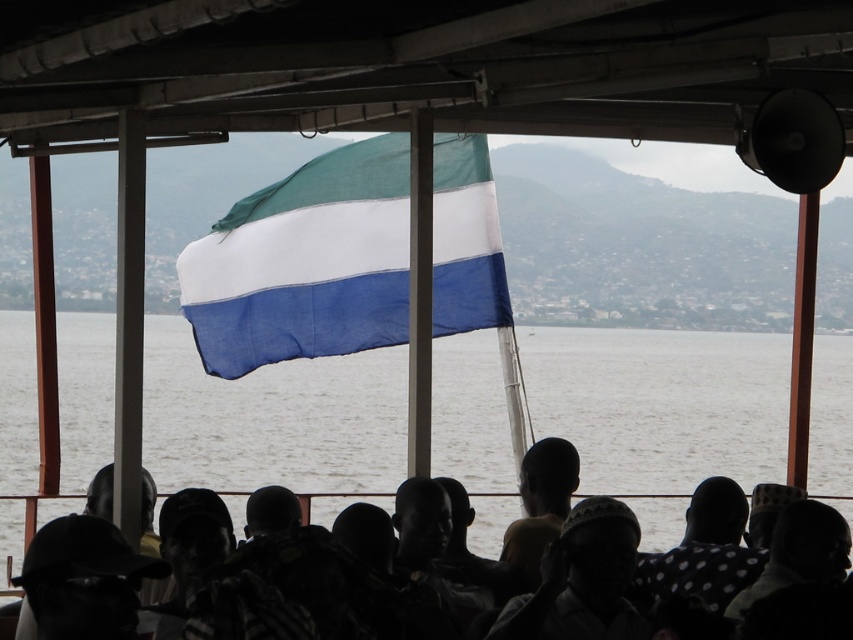
Can you confirm if blue fabric water at center is taller than textured fabric flag at center?

Yes, blue fabric water at center is taller than textured fabric flag at center.

Between point (7, 433) and point (231, 358), which one is positioned in front?

Positioned in front is point (231, 358).

What do you see at coordinates (660, 404) in the screenshot? The width and height of the screenshot is (853, 640). I see `blue fabric water at center` at bounding box center [660, 404].

At what (x,y) coordinates should I click in order to perform the action: click on blue fabric water at center. Please return your answer as a coordinate pair (x, y). Looking at the image, I should click on (660, 404).

Is point (625, 394) closer to viewer compared to point (569, 460)?

No, it is behind (569, 460).

Identify the location of blue fabric water at center. (660, 404).

The image size is (853, 640). What do you see at coordinates (660, 404) in the screenshot? I see `blue fabric water at center` at bounding box center [660, 404].

Where is `blue fabric water at center`? Image resolution: width=853 pixels, height=640 pixels. blue fabric water at center is located at coordinates (660, 404).

Does point (460, 266) come behind point (96, 486)?

Yes, it is.

Does textured fabric flag at center appear over silhouette headscarf at center?

Correct, textured fabric flag at center is located above silhouette headscarf at center.

Who is more forward, (376,170) or (21,620)?

Point (21,620) is more forward.

Identify the location of textured fabric flag at center. This screenshot has height=640, width=853. (305, 262).